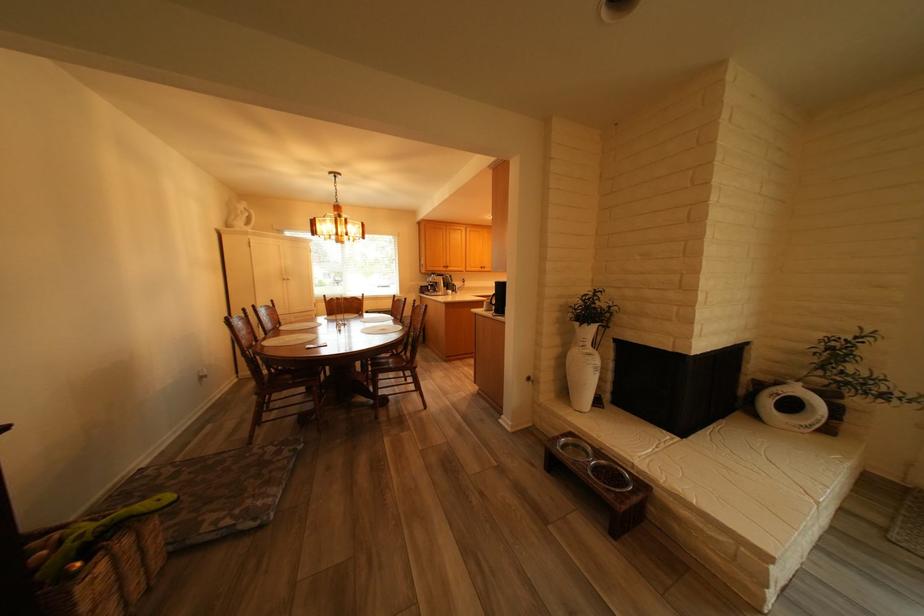
Find where to lift the white ring sculpture. Please return your answer as a coordinate pair (x, y).

(238, 215)